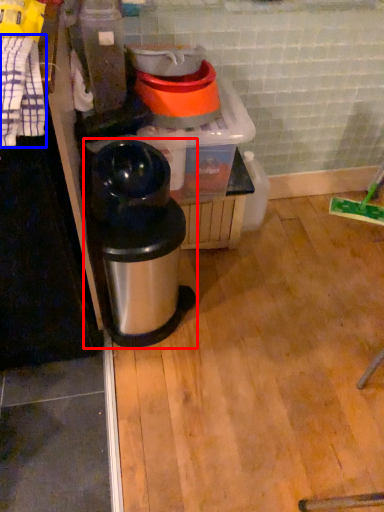
Question: Among these objects, which one is farthest to the camera, waste container (highlighted by a red box) or laundry (highlighted by a blue box)?

Choices:
 (A) waste container
 (B) laundry

Answer: (A)